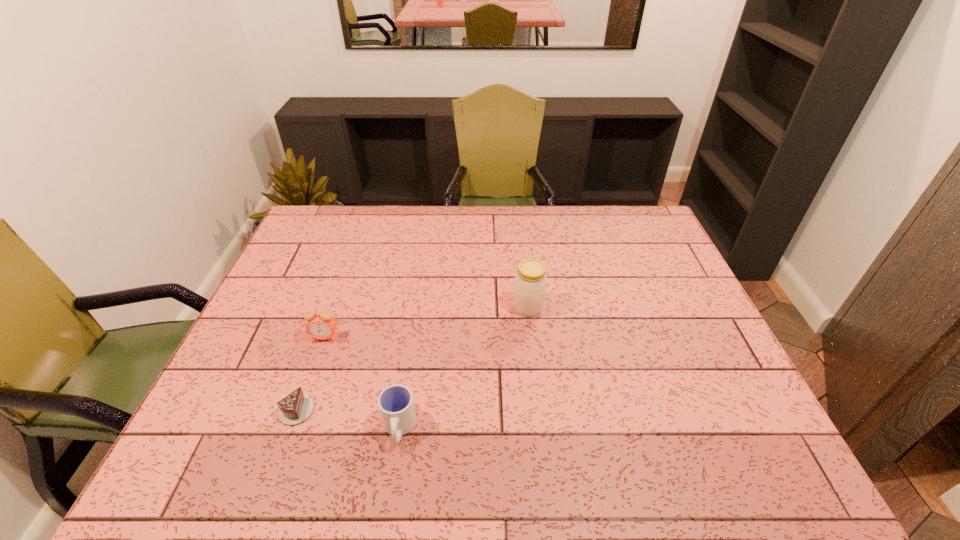
Locate an element on the screen. This screenshot has height=540, width=960. the tallest object is located at coordinates [530, 281].

Find the location of a particular element. This screenshot has width=960, height=540. jar is located at coordinates (530, 281).

Where is `the third shortest object`? the third shortest object is located at coordinates (321, 325).

The width and height of the screenshot is (960, 540). Identify the location of the third nearest object. (321, 325).

Where is `cup`? This screenshot has width=960, height=540. cup is located at coordinates (396, 405).

Where is `the third object from left to right`? The width and height of the screenshot is (960, 540). the third object from left to right is located at coordinates (396, 405).

You are a GUI agent. You are given a task and a screenshot of the screen. Output one action in this format:
    pyautogui.click(x=<x>, y=<y>)
    Task: Click on the chocolate cake
    The image size is (960, 540).
    Given the screenshot: What is the action you would take?
    pyautogui.click(x=296, y=407)

Image resolution: width=960 pixels, height=540 pixels. In order to click on free location located 0.220m on the right of the farthest object in this screenshot , I will do `click(619, 307)`.

The height and width of the screenshot is (540, 960). I want to click on free region located 0.130m on the face of the alarm clock, so pyautogui.click(x=309, y=383).

The image size is (960, 540). I want to click on free space located on the back of the chocolate cake, so point(313,359).